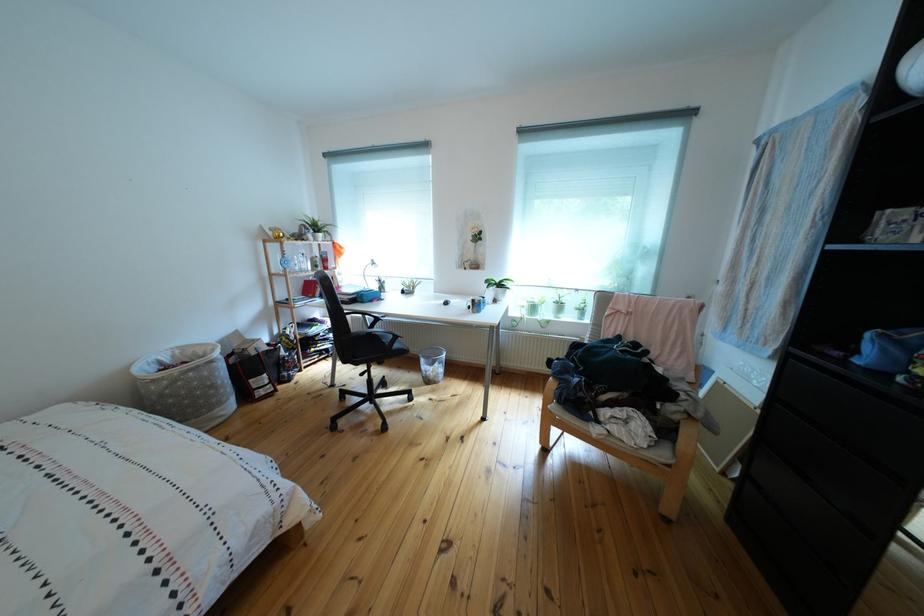
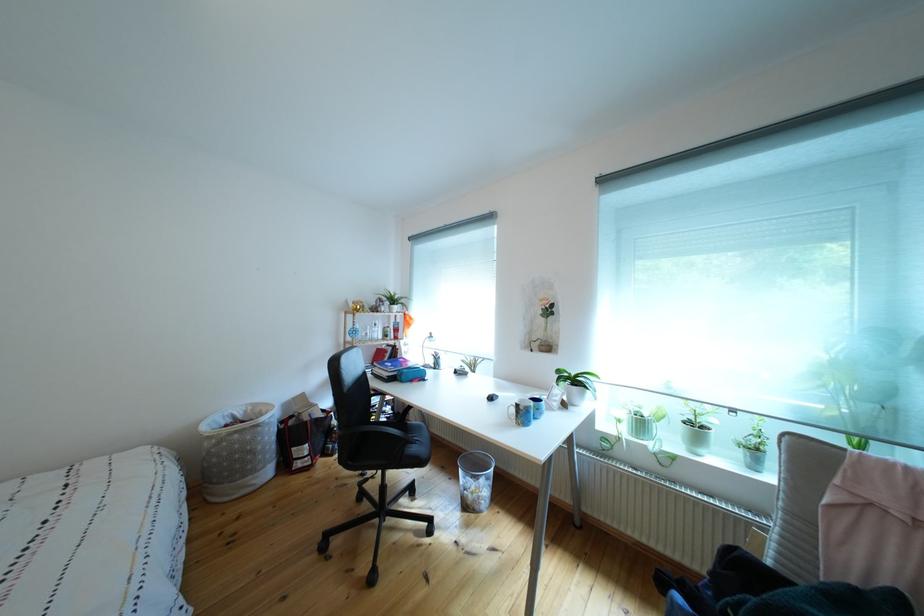
In the second image, find the point that corresponds to point 567,309 in the first image.

(699, 429)